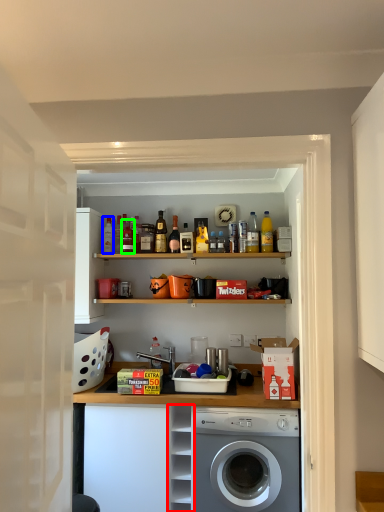
Question: Estimate the real-world distances between objects in this image. Which object is farther from cabinet (highlighted by a red box), bottle (highlighted by a blue box) or bottle (highlighted by a green box)?

Choices:
 (A) bottle
 (B) bottle

Answer: (A)